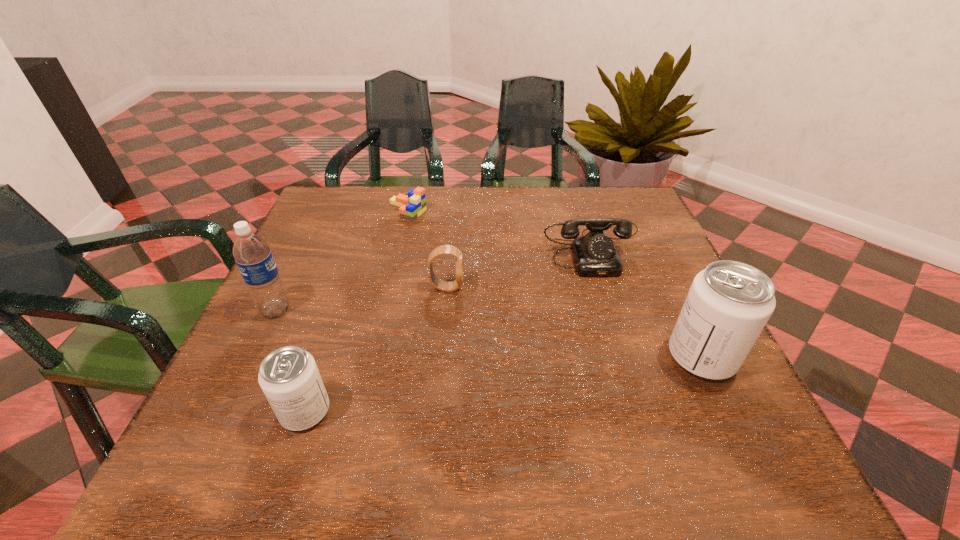
Locate an element on the screen. free location at the far left corner of the desktop is located at coordinates (370, 205).

Image resolution: width=960 pixels, height=540 pixels. Identify the location of vacant area at the near left corner of the desktop. (258, 382).

The height and width of the screenshot is (540, 960). I want to click on vacant space at the far right corner of the desktop, so click(x=606, y=197).

In the image, there is a desktop. Where is `vacant space at the near right corner`? The height and width of the screenshot is (540, 960). vacant space at the near right corner is located at coordinates (705, 380).

Identify the location of vacant space that is in between the shortest object and the fifth farthest object. (554, 284).

Find the location of a particular element. The image size is (960, 540). vacant area between the fourth shortest object and the Lego is located at coordinates (356, 311).

Locate an element on the screen. The height and width of the screenshot is (540, 960). free spot between the Lego and the leftmost object is located at coordinates (342, 260).

Where is `free space between the left soda can and the telephone`? The height and width of the screenshot is (540, 960). free space between the left soda can and the telephone is located at coordinates (449, 329).

The image size is (960, 540). What are the coordinates of `blank region between the watch and the taller soda can` in the screenshot? It's located at (574, 322).

Locate an element on the screen. The height and width of the screenshot is (540, 960). vacant space that's between the leftmost object and the third object from left to right is located at coordinates (342, 260).